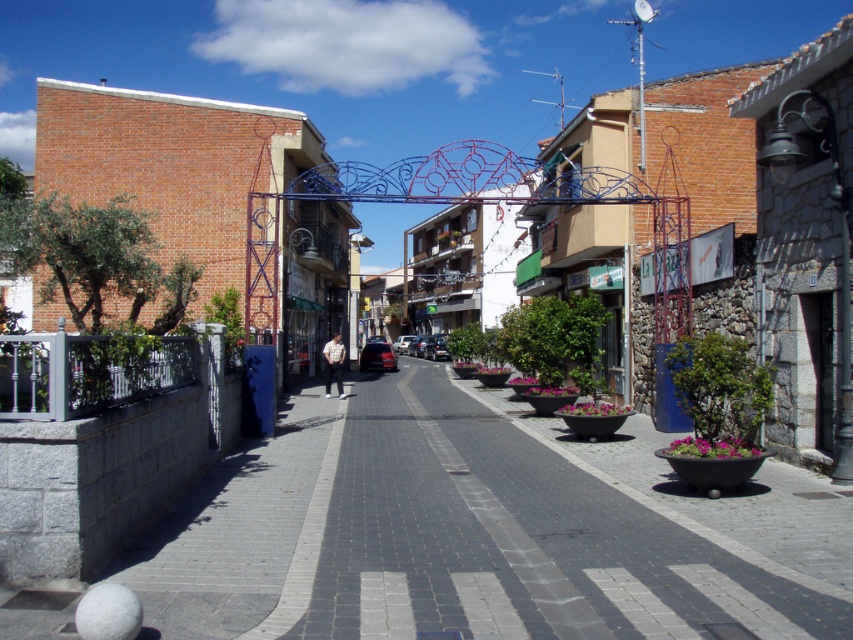
Question: Does gray concrete pavement at center appear on the right side of white cotton shirt at center?

Choices:
 (A) no
 (B) yes

Answer: (B)

Question: Does gray concrete pavement at center appear over white cotton shirt at center?

Choices:
 (A) yes
 (B) no

Answer: (B)

Question: Which object appears closest to the camera in this image?

Choices:
 (A) white cotton shirt at center
 (B) gray concrete pavement at center

Answer: (B)

Question: Can you confirm if gray concrete pavement at center is thinner than white cotton shirt at center?

Choices:
 (A) yes
 (B) no

Answer: (B)

Question: Which point appears farthest from the camera in this image?

Choices:
 (A) (326, 394)
 (B) (259, 516)

Answer: (A)